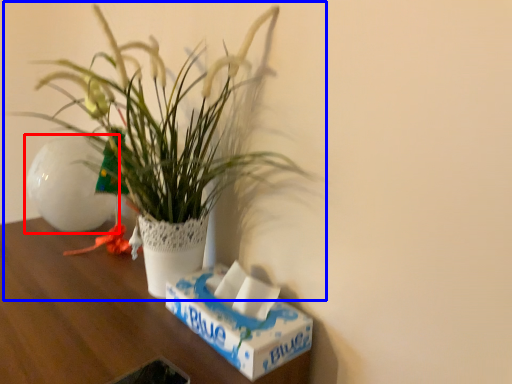
Question: Which object appears farthest to the camera in this image, flowerpot (highlighted by a red box) or houseplant (highlighted by a blue box)?

Choices:
 (A) flowerpot
 (B) houseplant

Answer: (A)